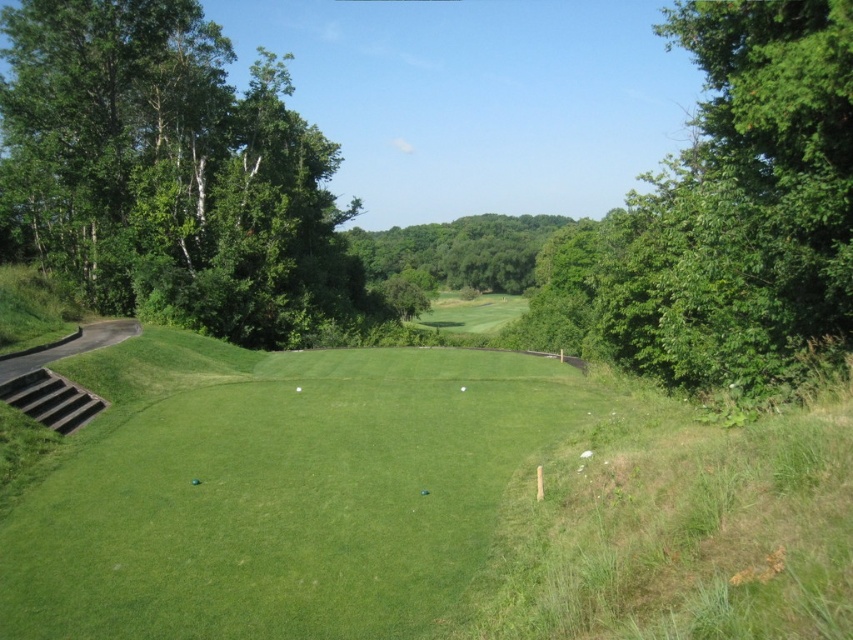
In the scene shown: Between green grassy golf course at center and green smooth golf ball at center, which one has less height?

Standing shorter between the two is green smooth golf ball at center.

Is point (252, 470) closer to viewer compared to point (463, 387)?

Yes, it is.

This screenshot has width=853, height=640. What are the coordinates of `green grassy golf course at center` in the screenshot? It's located at (276, 490).

Where is `green grassy golf course at center`? green grassy golf course at center is located at coordinates (276, 490).

Is green leafy tree at upper right smaller than green leafy trees at center?

Indeed, green leafy tree at upper right has a smaller size compared to green leafy trees at center.

The height and width of the screenshot is (640, 853). Find the location of `green leafy tree at upper right`. green leafy tree at upper right is located at coordinates (730, 211).

Can you confirm if green leafy tree at left is positioned above green leafy tree at upper right?

No.

Does green leafy tree at left have a lesser height compared to green leafy tree at upper right?

Yes, green leafy tree at left is shorter than green leafy tree at upper right.

Which is in front, point (10, 256) or point (752, 88)?

Point (752, 88) is in front.

Locate an element on the screen. green leafy tree at left is located at coordinates (171, 177).